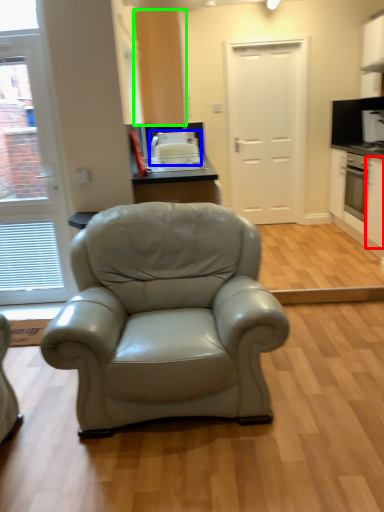
Question: Which object is positioned closest to cabinetry (highlighted by a red box)? Select from appliance (highlighted by a blue box) and cabinetry (highlighted by a green box).

Choices:
 (A) appliance
 (B) cabinetry

Answer: (A)